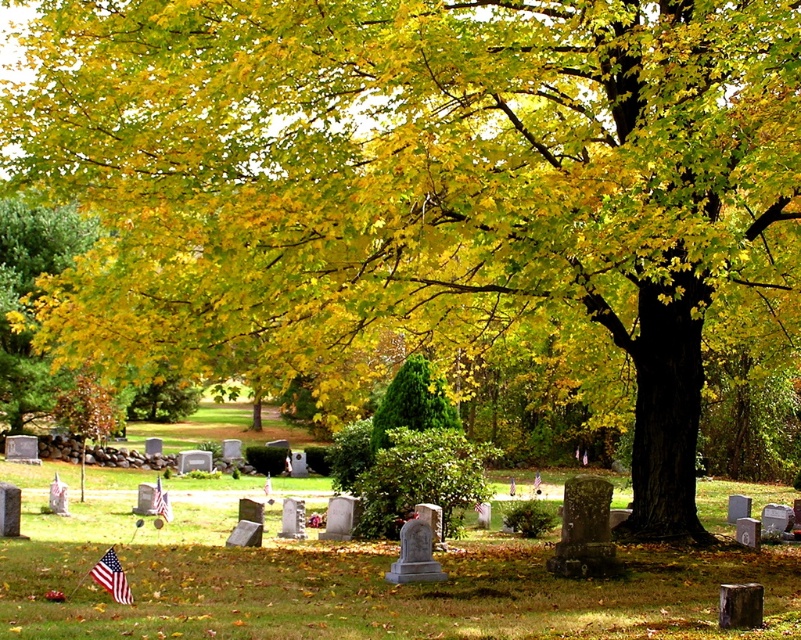
Question: Can you confirm if green textured evergreen tree at center is wider than american flag at center?

Choices:
 (A) no
 (B) yes

Answer: (B)

Question: Is green textured evergreen tree at center positioned at the back of american flag at center?

Choices:
 (A) yes
 (B) no

Answer: (A)

Question: Which point is closer to the camera taking this photo?

Choices:
 (A) (164, 512)
 (B) (433, 403)
 (C) (111, 563)

Answer: (C)

Question: Which of the following is the farthest from the observer?

Choices:
 (A) american flag at center
 (B) american flag at lower left

Answer: (A)

Question: Among these points, which one is farthest from the camera?

Choices:
 (A) (166, 493)
 (B) (127, 598)

Answer: (A)

Question: Can you confirm if green textured evergreen tree at center is bigger than american flag at lower left?

Choices:
 (A) yes
 (B) no

Answer: (A)